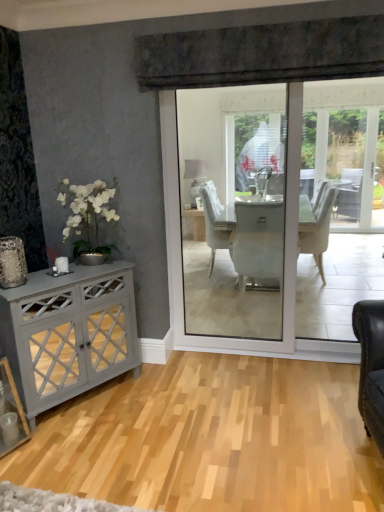
What are the coordinates of `unoccupied region to the right of matte gray cabinet at left` in the screenshot? It's located at (160, 403).